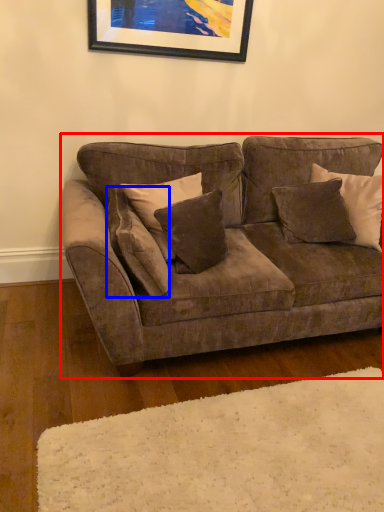
Question: Among these objects, which one is nearest to the camera, studio couch (highlighted by a red box) or pillow (highlighted by a blue box)?

Choices:
 (A) studio couch
 (B) pillow

Answer: (A)